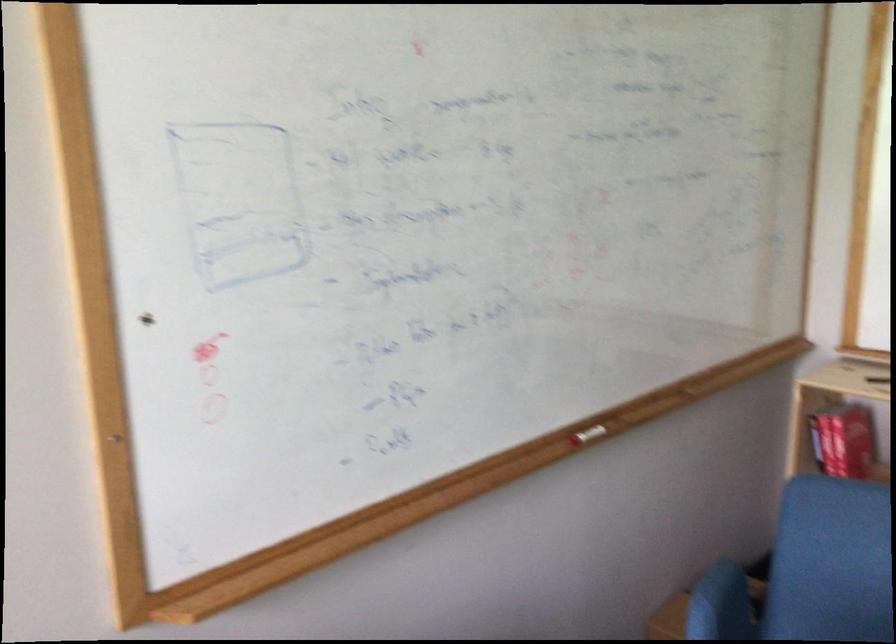
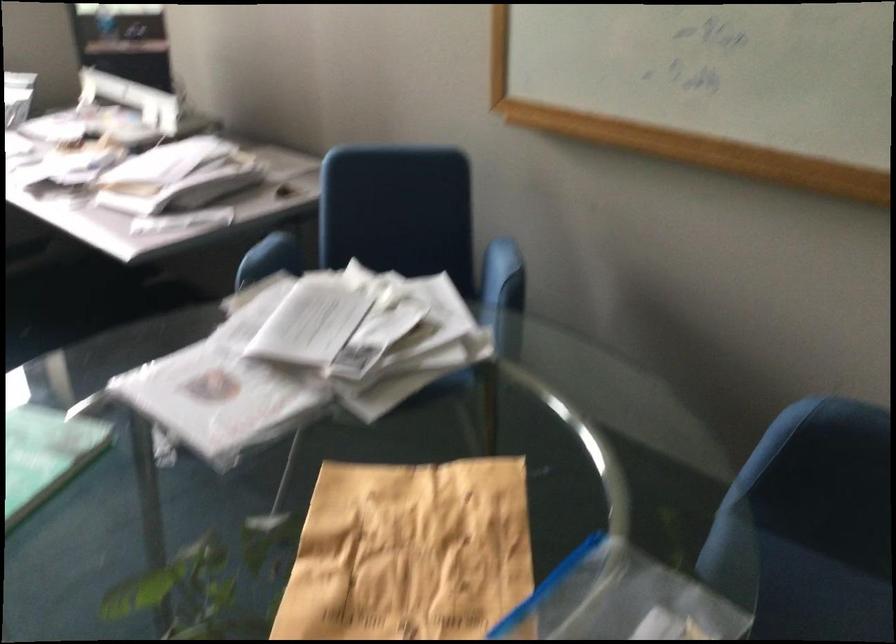
Where in the second image is the point corresponding to (x=476, y=571) from the first image?

(785, 270)